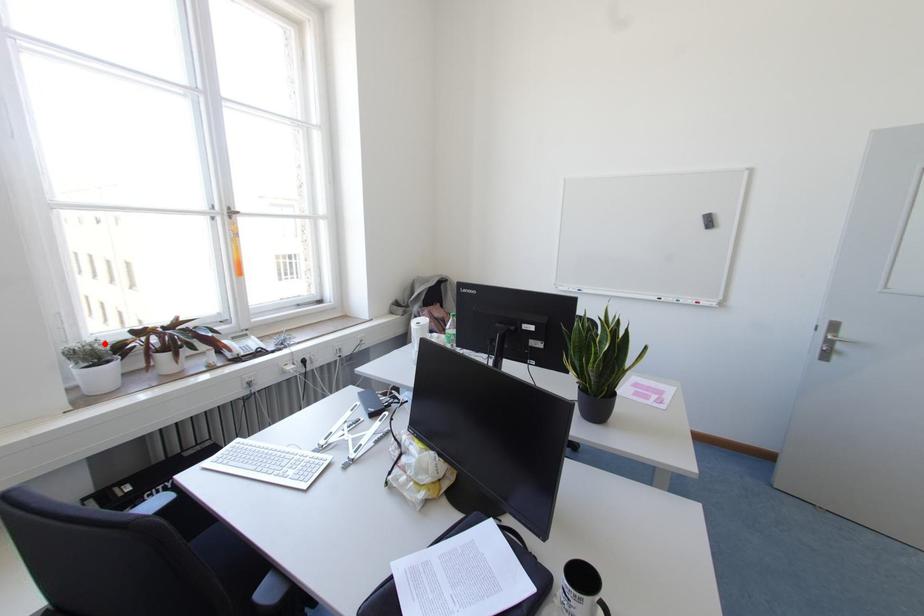
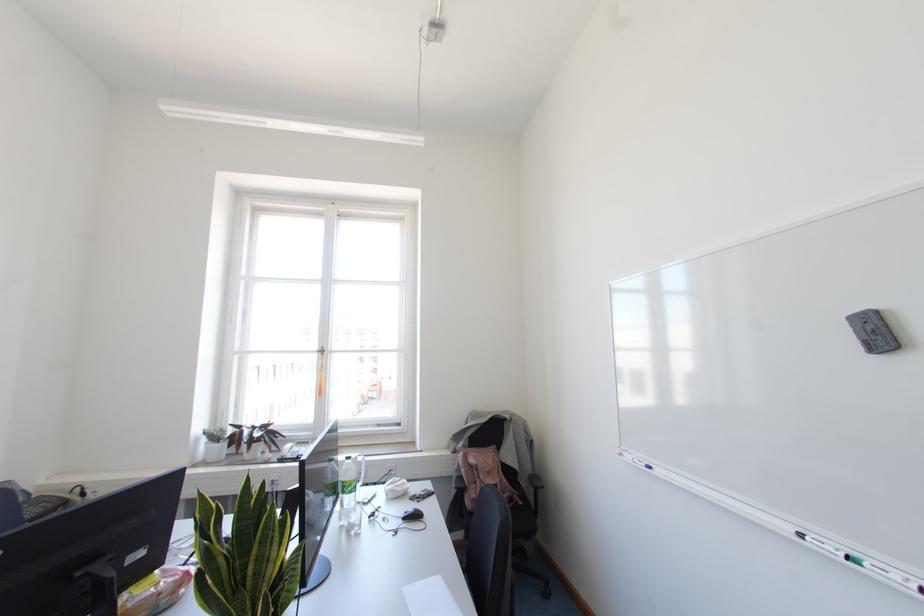
Find the pixel in the second image that matches the highlighted location in the first image.

(223, 431)